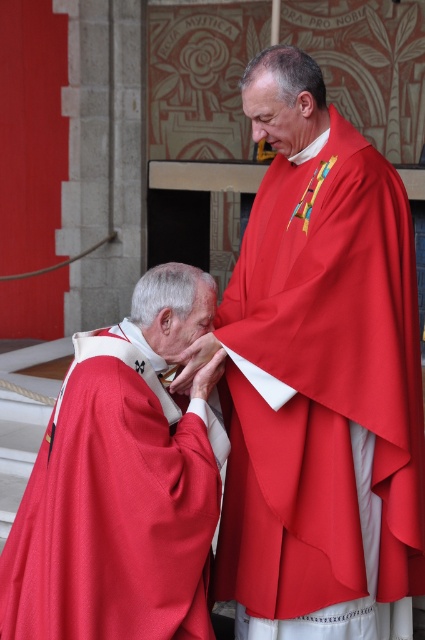
Question: Is matte red robe at center to the left of matte red cape at left from the viewer's perspective?

Choices:
 (A) no
 (B) yes

Answer: (A)

Question: Does matte red robe at center have a smaller size compared to matte red cape at left?

Choices:
 (A) yes
 (B) no

Answer: (B)

Question: Which object is closer to the camera taking this photo?

Choices:
 (A) matte red robe at center
 (B) matte red cape at left

Answer: (B)

Question: Does matte red robe at center have a smaller size compared to matte red cape at left?

Choices:
 (A) yes
 (B) no

Answer: (B)

Question: Which point appears closest to the camera in this image?

Choices:
 (A) (257, 236)
 (B) (108, 627)

Answer: (B)

Question: Which point is closer to the camera?

Choices:
 (A) (64, 406)
 (B) (421, 481)

Answer: (A)